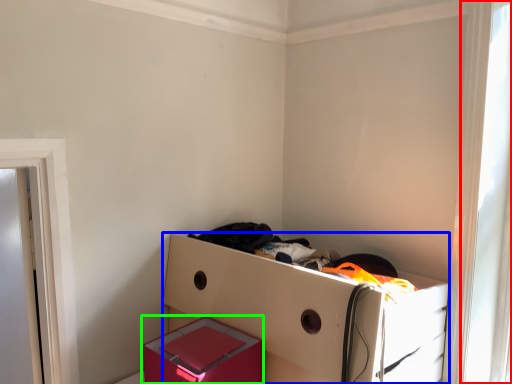
Question: Which object is the farthest from window (highlighted by a red box)? Choose among these: furniture (highlighted by a blue box) or box (highlighted by a green box).

Choices:
 (A) furniture
 (B) box

Answer: (B)